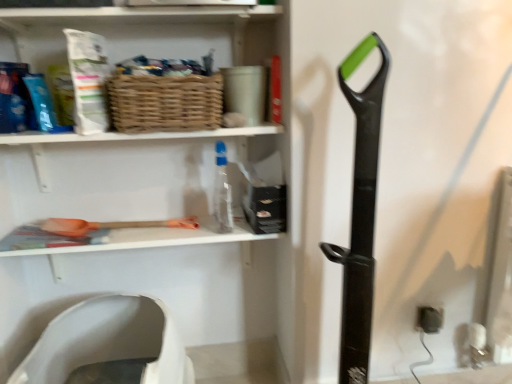
In order to click on transparent plastic bottle at center in this screenshot , I will do `click(222, 192)`.

Identify the location of matte wicker basket at upper center, arranged as the 1th shelf when viewed from the top. This screenshot has height=384, width=512. (144, 30).

You are a GUI agent. You are given a task and a screenshot of the screen. Output one action in this format:
    pyautogui.click(x=<x>, y=<y>)
    Task: Click on the white matte shelf at upper center, the 2th shelf when ordered from top to bottom
    The height and width of the screenshot is (384, 512).
    Given the screenshot: What is the action you would take?
    pyautogui.click(x=127, y=189)

What do you see at coordinates (164, 103) in the screenshot?
I see `woven brown basket at upper center` at bounding box center [164, 103].

I want to click on white plastic toilet seat at lower left, so click(x=109, y=341).

Identify the location of transparent plastic bottle at center. The height and width of the screenshot is (384, 512). (222, 192).

Is white plastic toilet seat at lower left positioned with its back to white matte shelf at upper center, which appears as the 1th shelf when ordered from the bottom?

white plastic toilet seat at lower left is not turned away from white matte shelf at upper center, which appears as the 1th shelf when ordered from the bottom.

Visually, is white plastic toilet seat at lower left positioned to the left or to the right of white matte shelf at upper center, which appears as the 1th shelf when ordered from the bottom?

Based on their positions, white plastic toilet seat at lower left is located to the left of white matte shelf at upper center, which appears as the 1th shelf when ordered from the bottom.

Is white plastic toilet seat at lower left in front of or behind white matte shelf at upper center, the 2th shelf when ordered from top to bottom, in the image?

In the image, white plastic toilet seat at lower left appears in front of white matte shelf at upper center, the 2th shelf when ordered from top to bottom.

Where is `bottle below the white matte shelf at upper center, the 2th shelf when ordered from top to bottom (from the image's perspective)`? bottle below the white matte shelf at upper center, the 2th shelf when ordered from top to bottom (from the image's perspective) is located at coordinates (222, 192).

Is the surface of white matte shelf at upper center, the 2th shelf when ordered from top to bottom, in direct contact with transparent plastic bottle at center?

There is a gap between white matte shelf at upper center, the 2th shelf when ordered from top to bottom, and transparent plastic bottle at center.

Who is more distant, white matte shelf at upper center, which appears as the 1th shelf when ordered from the bottom, or transparent plastic bottle at center?

transparent plastic bottle at center is further from the camera.

Is black plastic electric outlet at lower right at the right side of woven brown basket at upper center?

Yes.

Between black plastic electric outlet at lower right and woven brown basket at upper center, which one has larger width?

woven brown basket at upper center.

You are a GUI agent. You are given a task and a screenshot of the screen. Output one action in this format:
    pyautogui.click(x=<x>, y=<y>)
    Task: Click on the basket positioned vertically above the black plastic electric outlet at lower right (from a real-world perspective)
    This screenshot has width=512, height=384.
    Given the screenshot: What is the action you would take?
    pyautogui.click(x=164, y=103)

Could you tell me if black plastic electric outlet at lower right is facing woven brown basket at upper center?

No, black plastic electric outlet at lower right is not oriented towards woven brown basket at upper center.

Would you consider matte wicker basket at upper center, arranged as the 1th shelf when viewed from the top, to be distant from transparent plastic bottle at center?

No, matte wicker basket at upper center, arranged as the 1th shelf when viewed from the top, is in close proximity to transparent plastic bottle at center.

Considering the points (138, 34) and (222, 189), which point is in front, point (138, 34) or point (222, 189)?

Point (138, 34)

Between matte wicker basket at upper center, arranged as the 1th shelf when viewed from the top, and transparent plastic bottle at center, which one has larger size?

With larger size is matte wicker basket at upper center, arranged as the 1th shelf when viewed from the top.

Choose the correct answer: Is matte wicker basket at upper center, arranged as the 1th shelf when viewed from the top, inside transparent plastic bottle at center or outside it?

matte wicker basket at upper center, arranged as the 1th shelf when viewed from the top, is spatially situated outside transparent plastic bottle at center.

Considering the relative sizes of black plastic electric outlet at lower right and transparent plastic bottle at center in the image provided, is black plastic electric outlet at lower right thinner than transparent plastic bottle at center?

Yes.

In the scene shown: Which object is further away from the camera, black plastic electric outlet at lower right or transparent plastic bottle at center?

black plastic electric outlet at lower right is further away from the camera.

Does point (442, 315) come farther from viewer compared to point (217, 186)?

That is True.

Does woven brown basket at upper center have a lesser height compared to matte wicker basket at upper center, which ranks as the second shelf in bottom-to-top order?

Yes, woven brown basket at upper center is shorter than matte wicker basket at upper center, which ranks as the second shelf in bottom-to-top order.

Is woven brown basket at upper center turned away from matte wicker basket at upper center, arranged as the 1th shelf when viewed from the top?

No, woven brown basket at upper center is not facing the opposite direction of matte wicker basket at upper center, arranged as the 1th shelf when viewed from the top.

From a real-world perspective, does woven brown basket at upper center sit lower than matte wicker basket at upper center, arranged as the 1th shelf when viewed from the top?

Indeed, from a real-world perspective, woven brown basket at upper center is positioned beneath matte wicker basket at upper center, arranged as the 1th shelf when viewed from the top.

Is woven brown basket at upper center in front of matte wicker basket at upper center, which ranks as the second shelf in bottom-to-top order?

No, it is behind matte wicker basket at upper center, which ranks as the second shelf in bottom-to-top order.

How many degrees apart are the facing directions of black plastic electric outlet at lower right and white plastic toilet seat at lower left?

0.997 degrees separate the facing orientations of black plastic electric outlet at lower right and white plastic toilet seat at lower left.

Would you say white plastic toilet seat at lower left is part of black plastic electric outlet at lower right's contents?

No, white plastic toilet seat at lower left is not surrounded by black plastic electric outlet at lower right.

Which of these two, black plastic electric outlet at lower right or white plastic toilet seat at lower left, is wider?

With larger width is white plastic toilet seat at lower left.

Is point (429, 320) farther from camera compared to point (116, 338)?

No, it is not.

Identify the location of the 2nd shelf behind the white plastic toilet seat at lower left. (127, 189).

Where is `bottle that appears below the white matte shelf at upper center, the 2th shelf when ordered from top to bottom (from a real-world perspective)`? bottle that appears below the white matte shelf at upper center, the 2th shelf when ordered from top to bottom (from a real-world perspective) is located at coordinates (222, 192).

From the image, which object appears to be farther from black plastic electric outlet at lower right, white matte shelf at upper center, which appears as the 1th shelf when ordered from the bottom, or white plastic toilet seat at lower left?

white plastic toilet seat at lower left.

Estimate the real-world distances between objects in this image. Which object is further from white matte shelf at upper center, which appears as the 1th shelf when ordered from the bottom, black plastic electric outlet at lower right or woven brown basket at upper center?

Among the two, black plastic electric outlet at lower right is located further to white matte shelf at upper center, which appears as the 1th shelf when ordered from the bottom.

Based on the photo, estimate the real-world distances between objects in this image. Which object is closer to white plastic toilet seat at lower left, matte wicker basket at upper center, which ranks as the second shelf in bottom-to-top order, or transparent plastic bottle at center?

transparent plastic bottle at center is closer to white plastic toilet seat at lower left.

From the picture: From the image, which object appears to be nearer to matte wicker basket at upper center, which ranks as the second shelf in bottom-to-top order, woven brown basket at upper center or white plastic toilet seat at lower left?

woven brown basket at upper center is positioned closer to the anchor matte wicker basket at upper center, which ranks as the second shelf in bottom-to-top order.

Looking at the image, which one is located further to matte wicker basket at upper center, which ranks as the second shelf in bottom-to-top order, woven brown basket at upper center or white matte shelf at upper center, the 2th shelf when ordered from top to bottom?

white matte shelf at upper center, the 2th shelf when ordered from top to bottom.

When comparing their distances from white matte shelf at upper center, the 2th shelf when ordered from top to bottom, does transparent plastic bottle at center or black plastic electric outlet at lower right seem further?

black plastic electric outlet at lower right is positioned further to the anchor white matte shelf at upper center, the 2th shelf when ordered from top to bottom.

Which object lies nearer to the anchor point transparent plastic bottle at center, white matte shelf at upper center, the 2th shelf when ordered from top to bottom, or black plastic electric outlet at lower right?

The object closer to transparent plastic bottle at center is white matte shelf at upper center, the 2th shelf when ordered from top to bottom.

Which object lies further to the anchor point white matte shelf at upper center, which appears as the 1th shelf when ordered from the bottom, woven brown basket at upper center or black plastic electric outlet at lower right?

Based on the image, black plastic electric outlet at lower right appears to be further to white matte shelf at upper center, which appears as the 1th shelf when ordered from the bottom.

The width and height of the screenshot is (512, 384). I want to click on basket between white matte shelf at upper center, the 2th shelf when ordered from top to bottom, and transparent plastic bottle at center, in the horizontal direction, so click(x=164, y=103).

The height and width of the screenshot is (384, 512). In order to click on shelf between matte wicker basket at upper center, which ranks as the second shelf in bottom-to-top order, and white plastic toilet seat at lower left, in the vertical direction in this screenshot , I will do `click(127, 189)`.

At what (x,y) coordinates should I click in order to perform the action: click on bottle between matte wicker basket at upper center, arranged as the 1th shelf when viewed from the top, and white plastic toilet seat at lower left, in the vertical direction. Please return your answer as a coordinate pair (x, y). This screenshot has height=384, width=512. Looking at the image, I should click on (222, 192).

Where is `basket between matte wicker basket at upper center, arranged as the 1th shelf when viewed from the top, and white matte shelf at upper center, which appears as the 1th shelf when ordered from the bottom, in the vertical direction`? Image resolution: width=512 pixels, height=384 pixels. basket between matte wicker basket at upper center, arranged as the 1th shelf when viewed from the top, and white matte shelf at upper center, which appears as the 1th shelf when ordered from the bottom, in the vertical direction is located at coordinates (164, 103).